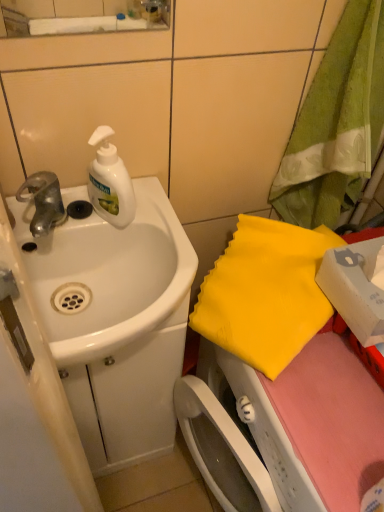
Question: Can you confirm if silver metallic faucet at left is taller than white glossy sink at left?

Choices:
 (A) yes
 (B) no

Answer: (B)

Question: From a real-world perspective, is silver metallic faucet at left below white glossy sink at left?

Choices:
 (A) no
 (B) yes

Answer: (A)

Question: Would you say silver metallic faucet at left is a long distance from white glossy sink at left?

Choices:
 (A) no
 (B) yes

Answer: (A)

Question: From a real-world perspective, is silver metallic faucet at left physically above white glossy sink at left?

Choices:
 (A) no
 (B) yes

Answer: (B)

Question: Does silver metallic faucet at left contain white glossy sink at left?

Choices:
 (A) no
 (B) yes

Answer: (A)

Question: Is silver metallic faucet at left further to the viewer compared to white glossy sink at left?

Choices:
 (A) yes
 (B) no

Answer: (A)

Question: Is yellow fabric at right, the 1th beach towel positioned from the bottom, outside of green fabric towel at upper right, marked as the first beach towel in a top-to-bottom arrangement?

Choices:
 (A) yes
 (B) no

Answer: (A)

Question: Is yellow fabric at right, which ranks as the second beach towel in top-to-bottom order, oriented away from green fabric towel at upper right, marked as the first beach towel in a top-to-bottom arrangement?

Choices:
 (A) yes
 (B) no

Answer: (A)

Question: Is yellow fabric at right, the 1th beach towel positioned from the bottom, thinner than green fabric towel at upper right, marked as the first beach towel in a top-to-bottom arrangement?

Choices:
 (A) no
 (B) yes

Answer: (A)

Question: Can you confirm if yellow fabric at right, the 1th beach towel positioned from the bottom, is shorter than green fabric towel at upper right, marked as the first beach towel in a top-to-bottom arrangement?

Choices:
 (A) yes
 (B) no

Answer: (A)

Question: Can you confirm if yellow fabric at right, which ranks as the second beach towel in top-to-bottom order, is wider than green fabric towel at upper right, marked as the first beach towel in a top-to-bottom arrangement?

Choices:
 (A) no
 (B) yes

Answer: (B)

Question: Is yellow fabric at right, which ranks as the second beach towel in top-to-bottom order, at the left side of green fabric towel at upper right, marked as the first beach towel in a top-to-bottom arrangement?

Choices:
 (A) yes
 (B) no

Answer: (A)

Question: From the image's perspective, is silver metallic faucet at left above yellow fabric at right, which ranks as the second beach towel in top-to-bottom order?

Choices:
 (A) no
 (B) yes

Answer: (B)